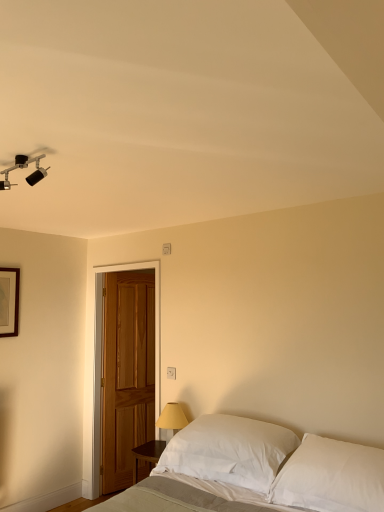
The width and height of the screenshot is (384, 512). I want to click on vacant area on top of matte black track light at upper left (from a real-world perspective), so click(x=32, y=152).